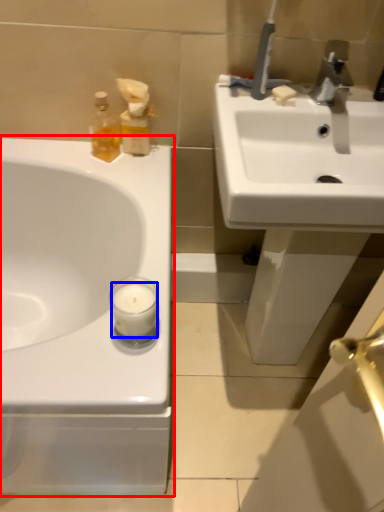
Question: Which point is further to the camera, sink (highlighted by a red box) or candle (highlighted by a blue box)?

Choices:
 (A) sink
 (B) candle

Answer: (B)